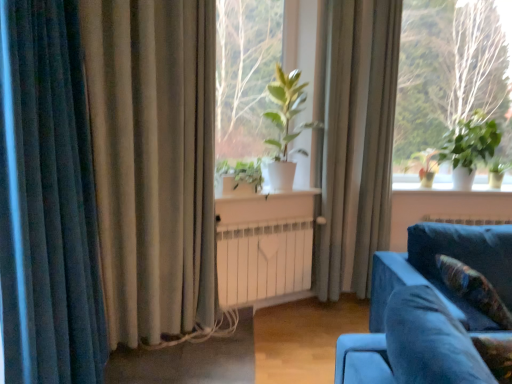
Locate an element on the screen. unoccupied region to the right of beige fabric curtain at left, arranged as the 2th curtain when viewed from the left is located at coordinates (233, 357).